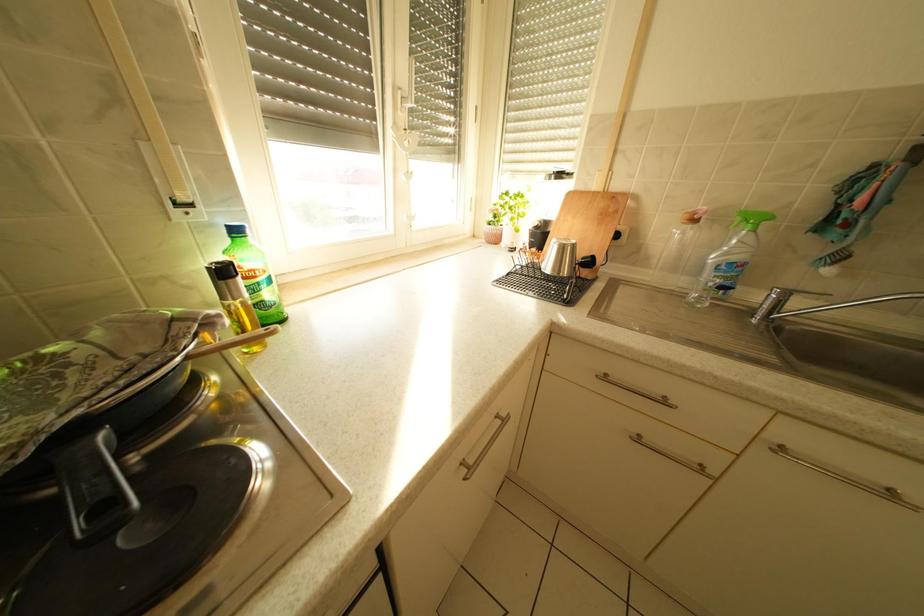
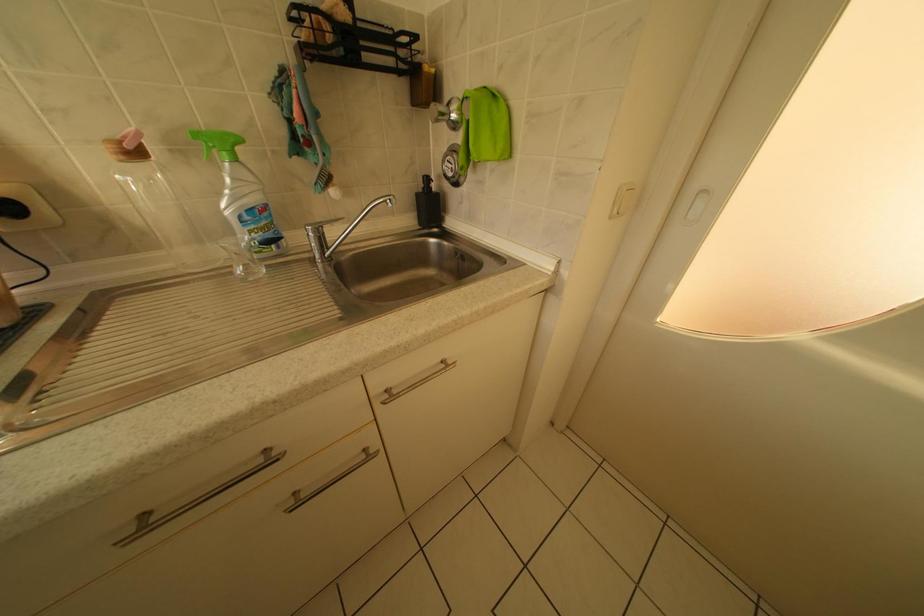
The images are taken continuously from a first-person perspective. In which direction is your viewpoint rotating?

The camera rotated toward right-down.